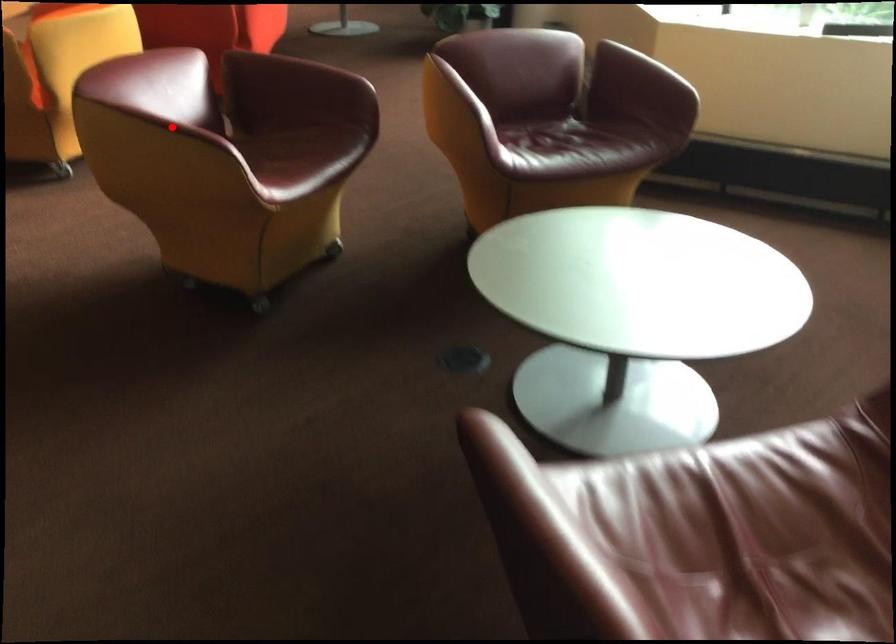
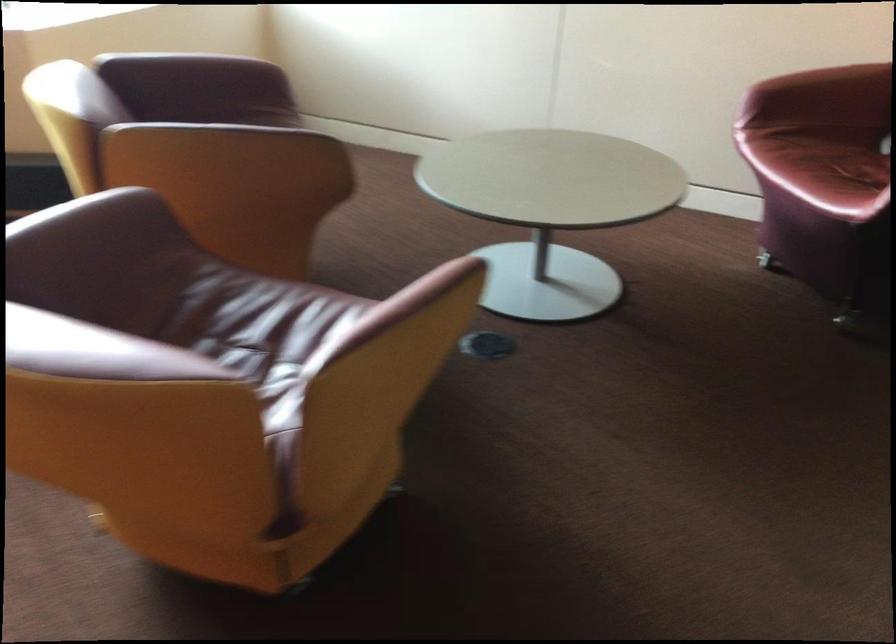
Question: I am providing you with two images of the same scene from different viewpoints. A red point is marked on the first image. Is the red point's position out of view in image 2?

Choices:
 (A) Yes
 (B) No

Answer: (A)